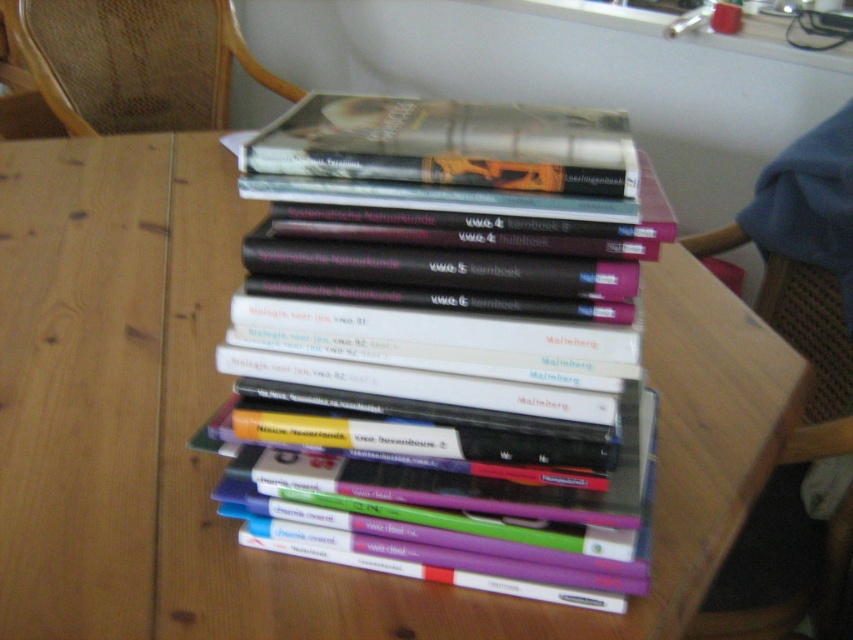
You are sitting in the woven cane chair at upper left and want to reach the hardcover book at center. Can you comfortably reach it without getting up?

The hardcover book at center is 6.91 feet away from the woven cane chair at upper left. Since 6.91 feet is approximately 2.1 meters, which is quite a distance, you would not be able to comfortably reach the hardcover book at center from the woven cane chair at upper left without getting up.

You are sitting in the woven cane chair at upper left and want to pick up the hardcover book at center. Can you easily reach it from your current position?

The hardcover book at center is located below the woven cane chair at upper left, so you can easily reach it from your current position.

You are a student who needs to find a specific book on the table. You see the point marked at coordinates (444, 397). Which book is located at that point?

The hardcover book at center is located at point (444, 397).